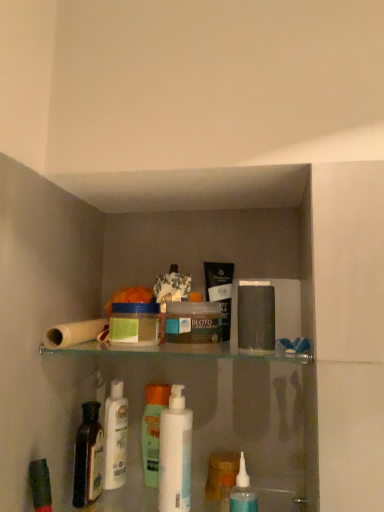
What do you see at coordinates (183, 355) in the screenshot? This screenshot has width=384, height=512. I see `clear glass shelf at center` at bounding box center [183, 355].

Locate an element on the screen. The width and height of the screenshot is (384, 512). white matte toilet paper at left is located at coordinates (76, 333).

You are a GUI agent. You are given a task and a screenshot of the screen. Output one action in this format:
    pyautogui.click(x=<x>, y=<y>)
    Task: Click on the translucent plastic bottle at lower center, the 1th mouthwash from the right
    Image resolution: width=384 pixels, height=512 pixels.
    Given the screenshot: What is the action you would take?
    pyautogui.click(x=243, y=492)

The image size is (384, 512). What do you see at coordinates (243, 492) in the screenshot?
I see `translucent plastic bottle at lower center, the 1th mouthwash from the right` at bounding box center [243, 492].

Find the location of a particular element. The image size is (384, 512). translucent plastic container at center, which is counted as the second product, starting from the left is located at coordinates (193, 322).

Considering the sizes of objects white glossy bottle at lower left and clear plastic container at center, which ranks as the second toiletry in left-to-right order, in the image provided, who is taller, white glossy bottle at lower left or clear plastic container at center, which ranks as the second toiletry in left-to-right order,?

Standing taller between the two is white glossy bottle at lower left.

From a real-world perspective, which object stands above the other?

clear plastic container at center, which is the 1th toiletry in right-to-left order, from a real-world perspective.

Is white glossy bottle at lower left next to clear plastic container at center, which is the 1th toiletry in right-to-left order, and touching it?

No, white glossy bottle at lower left is not in contact with clear plastic container at center, which is the 1th toiletry in right-to-left order.

Considering the points (108, 410) and (265, 349), which point is behind, point (108, 410) or point (265, 349)?

Point (108, 410)

Considering the sizes of objects white glossy mouthwash at center, the 2th mouthwash positioned from the front, and clear glass shelf at center in the image provided, who is taller, white glossy mouthwash at center, the 2th mouthwash positioned from the front, or clear glass shelf at center?

Standing taller between the two is clear glass shelf at center.

From a real-world perspective, between white glossy mouthwash at center, acting as the first mouthwash starting from the left, and clear glass shelf at center, who is vertically lower?

white glossy mouthwash at center, acting as the first mouthwash starting from the left.

Is white glossy mouthwash at center, acting as the first mouthwash starting from the left, inside or outside of clear glass shelf at center?

white glossy mouthwash at center, acting as the first mouthwash starting from the left, is spatially positioned inside clear glass shelf at center.

From the picture: From the image's perspective, which is below, white glossy mouthwash at center, marked as the second mouthwash in a right-to-left arrangement, or clear glass shelf at center?

white glossy mouthwash at center, marked as the second mouthwash in a right-to-left arrangement, is shown below in the image.

The image size is (384, 512). Identify the location of bottle located behind the white glossy mouthwash at center, the 2th mouthwash positioned from the front. (88, 457).

Consider the image. From the image's perspective, is white glossy mouthwash at center, the 2th mouthwash positioned from the front, on top of dark brown glass bottle at lower left?

Yes.

Is the surface of white glossy mouthwash at center, acting as the first mouthwash starting from the left, in direct contact with dark brown glass bottle at lower left?

No, white glossy mouthwash at center, acting as the first mouthwash starting from the left, is not touching dark brown glass bottle at lower left.

Can you confirm if translucent plastic bottle at lower center, the 2th mouthwash in the back-to-front sequence, is positioned to the left of white glossy bottle at lower left?

No, translucent plastic bottle at lower center, the 2th mouthwash in the back-to-front sequence, is not to the left of white glossy bottle at lower left.

Could you tell me if translucent plastic bottle at lower center, arranged as the second mouthwash when viewed from the left, is facing white glossy bottle at lower left?

No, translucent plastic bottle at lower center, arranged as the second mouthwash when viewed from the left, is not oriented towards white glossy bottle at lower left.

In the image, is translucent plastic bottle at lower center, arranged as the second mouthwash when viewed from the left, positioned in front of or behind white glossy bottle at lower left?

translucent plastic bottle at lower center, arranged as the second mouthwash when viewed from the left, is in front of white glossy bottle at lower left.

Does translucent plastic bottle at lower center, which ranks as the 1th mouthwash in front-to-back order, turn towards clear plastic container at center, the second toiletry when ordered from bottom to top?

No, translucent plastic bottle at lower center, which ranks as the 1th mouthwash in front-to-back order, is not turned towards clear plastic container at center, the second toiletry when ordered from bottom to top.

Is translucent plastic bottle at lower center, the 1th mouthwash from the right, to the left of clear plastic container at center, placed as the 2th toiletry when sorted from back to front, from the viewer's perspective?

Yes.

Image resolution: width=384 pixels, height=512 pixels. I want to click on toiletry on the right of the translucent plastic bottle at lower center, the 2th mouthwash in the back-to-front sequence, so click(x=256, y=317).

From the picture: From a real-world perspective, is translucent plastic container at center, which is counted as the second product, starting from the left, physically located above or below dark brown glass bottle at lower left?

In terms of real-world spatial position, translucent plastic container at center, which is counted as the second product, starting from the left, is above dark brown glass bottle at lower left.

Can you confirm if translucent plastic container at center, the 1th product when ordered from right to left, is smaller than dark brown glass bottle at lower left?

Actually, translucent plastic container at center, the 1th product when ordered from right to left, might be larger than dark brown glass bottle at lower left.

Looking at this image, from the image's perspective, is translucent plastic container at center, the 1th product when ordered from right to left, positioned above or below dark brown glass bottle at lower left?

translucent plastic container at center, the 1th product when ordered from right to left, is situated higher than dark brown glass bottle at lower left in the image.

Is translucent plastic container at center, which is counted as the second product, starting from the left, further to camera compared to dark brown glass bottle at lower left?

No, translucent plastic container at center, which is counted as the second product, starting from the left, is closer to the viewer.

Who is shorter, clear plastic container at center, which is the 1th toiletry in top-to-bottom order, or translucent plastic bottle at center, the 2th toiletry when ordered from top to bottom?

Standing shorter between the two is clear plastic container at center, which is the 1th toiletry in top-to-bottom order.

From a real-world perspective, who is located lower, clear plastic container at center, which ranks as the second toiletry in left-to-right order, or translucent plastic bottle at center, acting as the first toiletry starting from the left?

From a 3D spatial view, translucent plastic bottle at center, acting as the first toiletry starting from the left, is below.

Between clear plastic container at center, which is the 1th toiletry in top-to-bottom order, and translucent plastic bottle at center, acting as the first toiletry starting from the left, which one is positioned behind?

translucent plastic bottle at center, acting as the first toiletry starting from the left, is behind.

From the image's perspective, does clear plastic container at center, placed as the 2th toiletry when sorted from back to front, appear higher than translucent plastic bottle at center, acting as the first toiletry starting from the left?

Indeed, from the image's perspective, clear plastic container at center, placed as the 2th toiletry when sorted from back to front, is shown above translucent plastic bottle at center, acting as the first toiletry starting from the left.

At what (x,y) coordinates should I click in order to perform the action: click on the 2nd toiletry counting from the right of the white glossy bottle at lower left. Please return your answer as a coordinate pair (x, y). This screenshot has width=384, height=512. Looking at the image, I should click on (256, 317).

In order to click on shelf in front of the white glossy mouthwash at center, the 2th mouthwash positioned from the front in this screenshot , I will do [x=183, y=355].

Which object lies further to the anchor point translucent plastic bottle at lower center, which ranks as the 1th mouthwash in front-to-back order, white glossy bottle at lower left or translucent plastic bottle at center, the 2th toiletry when ordered from top to bottom?

Based on the image, white glossy bottle at lower left appears to be further to translucent plastic bottle at lower center, which ranks as the 1th mouthwash in front-to-back order.

Consider the image. From the image, which object appears to be nearer to green matte jar at center, the 1th product in the left-to-right sequence, translucent plastic container at center, which is counted as the second product, starting from the left, or translucent plastic bottle at lower center, which ranks as the 1th mouthwash in front-to-back order?

translucent plastic container at center, which is counted as the second product, starting from the left.

Looking at the image, which one is located further to white glossy mouthwash at center, marked as the second mouthwash in a right-to-left arrangement, translucent plastic bottle at center, the 2th toiletry in the right-to-left sequence, or translucent plastic container at center, the 1th product when ordered from right to left?

The object further to white glossy mouthwash at center, marked as the second mouthwash in a right-to-left arrangement, is translucent plastic container at center, the 1th product when ordered from right to left.

In the scene shown: Based on their spatial positions, is clear glass shelf at center or white matte toilet paper at left further from green matte jar at center, the 1th product in the left-to-right sequence?

clear glass shelf at center.

From the image, which object appears to be farther from translucent plastic bottle at lower center, which ranks as the 1th mouthwash in front-to-back order, clear plastic container at center, placed as the 2th toiletry when sorted from back to front, or translucent plastic container at center, the 1th product when ordered from right to left?

Based on the image, translucent plastic container at center, the 1th product when ordered from right to left, appears to be further to translucent plastic bottle at lower center, which ranks as the 1th mouthwash in front-to-back order.

Based on their spatial positions, is dark brown glass bottle at lower left or green matte jar at center, which appears as the 2th product when viewed from the right, further from white glossy mouthwash at center, the 2th mouthwash positioned from the front?

green matte jar at center, which appears as the 2th product when viewed from the right, is positioned further to the anchor white glossy mouthwash at center, the 2th mouthwash positioned from the front.

Estimate the real-world distances between objects in this image. Which object is further from clear glass shelf at center, translucent plastic container at center, the 1th product when ordered from right to left, or dark brown glass bottle at lower left?

dark brown glass bottle at lower left is further to clear glass shelf at center.

Considering their positions, is dark brown glass bottle at lower left positioned closer to translucent plastic container at center, the 1th product when ordered from right to left, than translucent plastic bottle at lower center, the 1th mouthwash from the right?

translucent plastic bottle at lower center, the 1th mouthwash from the right, is closer to translucent plastic container at center, the 1th product when ordered from right to left.

Locate an element on the screen. This screenshot has height=512, width=384. bottle between clear plastic container at center, which is the 1th toiletry in top-to-bottom order, and translucent plastic bottle at center, placed as the first toiletry when sorted from bottom to top, in the up-down direction is located at coordinates (88, 457).

What are the coordinates of `toiletry between clear glass shelf at center and dark brown glass bottle at lower left from top to bottom` in the screenshot? It's located at pos(256,317).

Identify the location of toiletry that lies between translucent plastic container at center, which is counted as the second product, starting from the left, and white glossy bottle at lower left from top to bottom. The height and width of the screenshot is (512, 384). (152, 430).

The height and width of the screenshot is (512, 384). I want to click on product between green matte jar at center, the 1th product in the left-to-right sequence, and translucent plastic bottle at lower center, which ranks as the 1th mouthwash in front-to-back order, in the vertical direction, so click(193, 322).